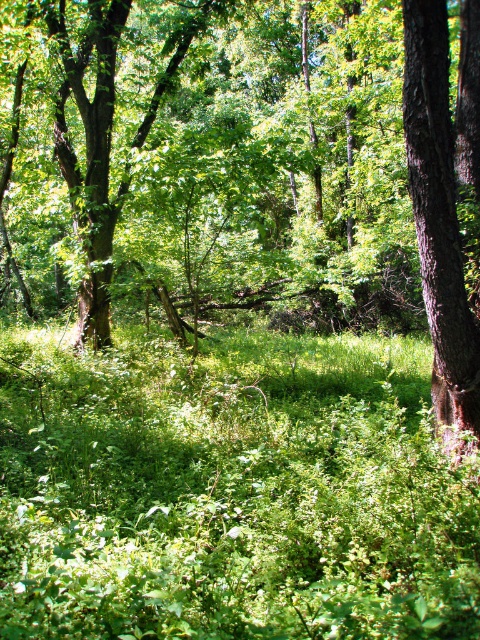
Question: Which object appears closest to the camera in this image?

Choices:
 (A) brown rough bark tree at right
 (B) green leafy tree at center
 (C) green leafy grass at center

Answer: (C)

Question: Does green leafy grass at center have a lesser width compared to brown rough bark tree at right?

Choices:
 (A) no
 (B) yes

Answer: (A)

Question: Which point is closer to the camera?

Choices:
 (A) green leafy grass at center
 (B) green leafy tree at center
 (C) brown rough bark tree at right

Answer: (A)

Question: Where is green leafy tree at center located in relation to green leafy grass at center in the image?

Choices:
 (A) below
 (B) above

Answer: (B)

Question: Which is nearer to the green leafy tree at center?

Choices:
 (A) brown rough bark tree at right
 (B) green leafy grass at center

Answer: (B)

Question: Does green leafy tree at center have a smaller size compared to green leafy grass at center?

Choices:
 (A) yes
 (B) no

Answer: (B)